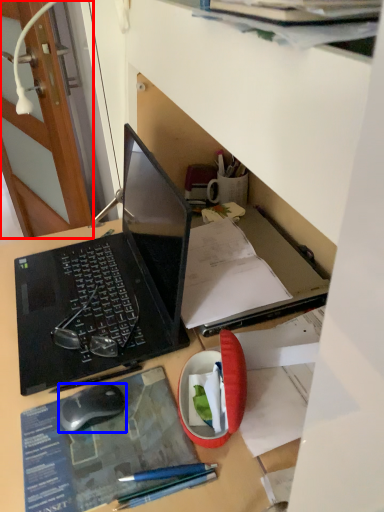
Question: Which object appears closest to the camera in this image, door (highlighted by a red box) or computer mouse (highlighted by a blue box)?

Choices:
 (A) door
 (B) computer mouse

Answer: (B)